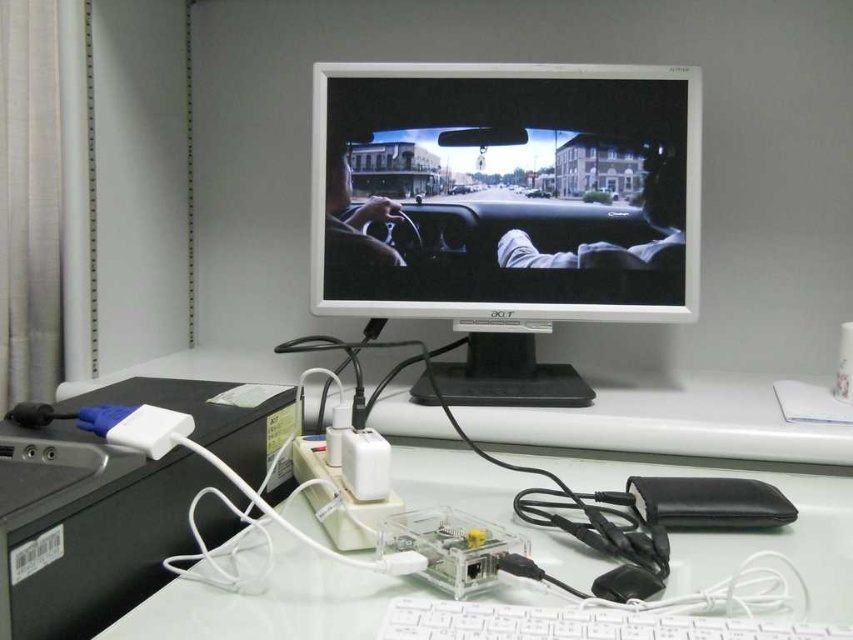
Question: Which point is farther from the camera taking this photo?

Choices:
 (A) (321, 74)
 (B) (538, 620)
 (C) (184, 627)

Answer: (A)

Question: Which point is closer to the camera?

Choices:
 (A) (671, 284)
 (B) (805, 563)

Answer: (B)

Question: Where is clear plastic electronics at center located in relation to white plastic keyboard at lower center in the image?

Choices:
 (A) below
 (B) above

Answer: (B)

Question: Estimate the real-world distances between objects in this image. Which object is closer to the clear plastic electronics at center?

Choices:
 (A) white plastic keyboard at lower center
 (B) white glossy monitor at center

Answer: (A)

Question: Is white glossy monitor at center wider than white plastic keyboard at lower center?

Choices:
 (A) yes
 (B) no

Answer: (A)

Question: Can you confirm if clear plastic electronics at center is positioned above white plastic keyboard at lower center?

Choices:
 (A) yes
 (B) no

Answer: (A)